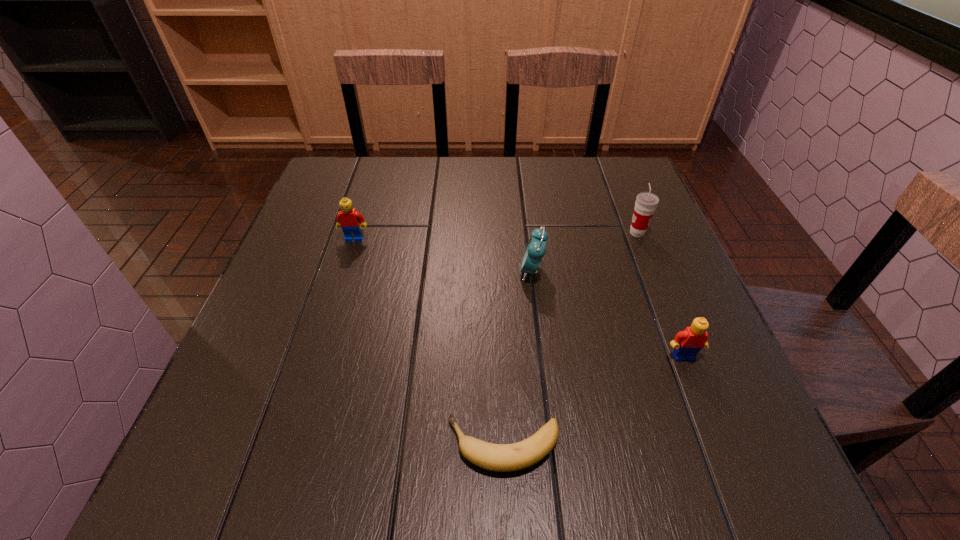
You are a GUI agent. You are given a task and a screenshot of the screen. Output one action in this format:
    pyautogui.click(x=<x>, y=<y>)
    Task: Click on the cup
    This screenshot has height=540, width=960.
    Given the screenshot: What is the action you would take?
    pyautogui.click(x=646, y=203)

Image resolution: width=960 pixels, height=540 pixels. I want to click on alarm clock, so click(535, 250).

Find the location of a particular element. The width and height of the screenshot is (960, 540). the left Lego is located at coordinates (351, 221).

The height and width of the screenshot is (540, 960). What are the coordinates of `the farther Lego` in the screenshot? It's located at (351, 221).

Locate an element on the screen. This screenshot has width=960, height=540. the second nearest object is located at coordinates (686, 344).

Where is `the nearer Lego`? the nearer Lego is located at coordinates (686, 344).

At what (x,y) coordinates should I click in order to perform the action: click on the nearest object. Please return your answer as a coordinate pair (x, y). The width and height of the screenshot is (960, 540). Looking at the image, I should click on (495, 457).

Locate an element on the screen. The image size is (960, 540). the shortest object is located at coordinates (495, 457).

Where is `vacant position located 0.120m on the side of the tallest object with the logo`? Image resolution: width=960 pixels, height=540 pixels. vacant position located 0.120m on the side of the tallest object with the logo is located at coordinates (577, 233).

What are the coordinates of `vacant space located on the side of the tallest object with the logo` in the screenshot? It's located at (569, 233).